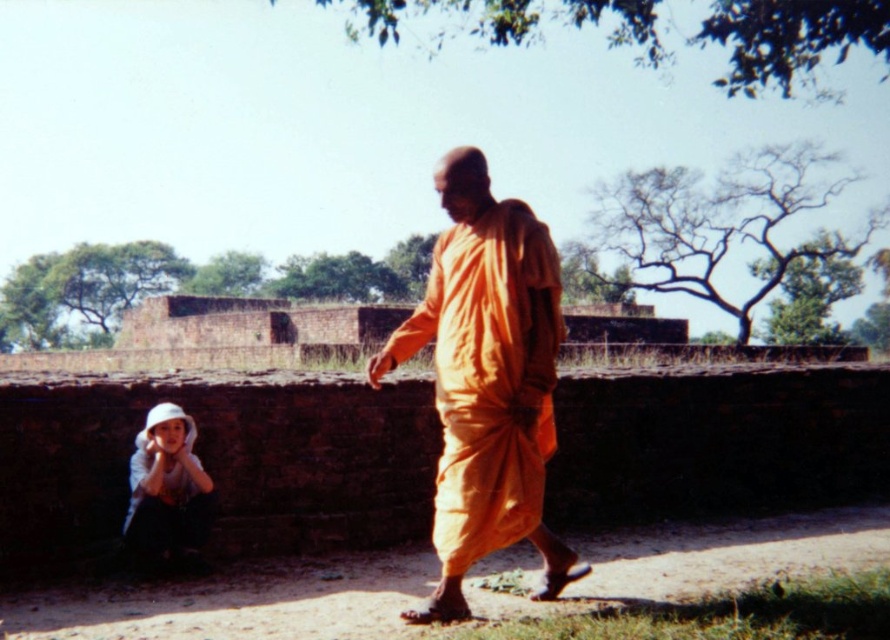
Question: Does orange clothed monk at center appear on the right side of white cotton hat at lower left?

Choices:
 (A) no
 (B) yes

Answer: (B)

Question: Which of the following is the farthest from the observer?

Choices:
 (A) orange clothed monk at center
 (B) white cotton hat at lower left

Answer: (B)

Question: Which point is closer to the camera?

Choices:
 (A) orange clothed monk at center
 (B) white cotton hat at lower left

Answer: (A)

Question: Can you confirm if orange clothed monk at center is smaller than white cotton hat at lower left?

Choices:
 (A) no
 (B) yes

Answer: (A)

Question: Which object appears farthest from the camera in this image?

Choices:
 (A) orange clothed monk at center
 (B) white cotton hat at lower left

Answer: (B)

Question: Does orange clothed monk at center have a lesser width compared to white cotton hat at lower left?

Choices:
 (A) yes
 (B) no

Answer: (B)